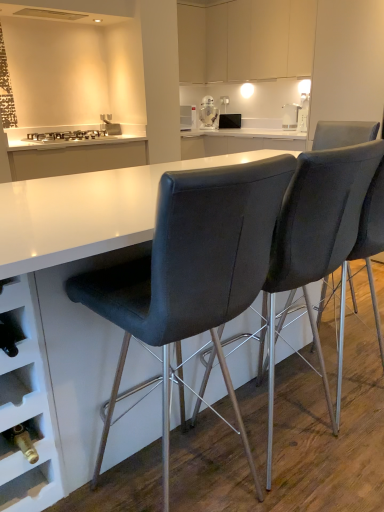
At what (x,y) coordinates should I click in order to perform the action: click on vacant space underneath matte black chair at center, arranged as the 2th chair when viewed from the left (from a real-world perspective). Please return your answer as a coordinate pair (x, y). Image resolution: width=384 pixels, height=512 pixels. Looking at the image, I should click on (302, 450).